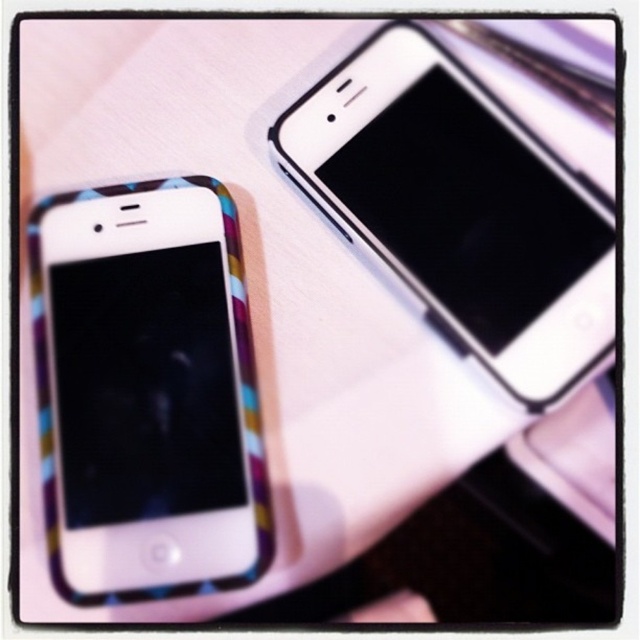
Question: Does matte plastic phone at left appear on the left side of white glossy smartphone at upper right?

Choices:
 (A) yes
 (B) no

Answer: (A)

Question: Which object appears closest to the camera in this image?

Choices:
 (A) white glossy smartphone at upper right
 (B) matte plastic phone at left

Answer: (B)

Question: Is matte plastic phone at left to the right of white glossy smartphone at upper right from the viewer's perspective?

Choices:
 (A) no
 (B) yes

Answer: (A)

Question: Is matte plastic phone at left thinner than white glossy smartphone at upper right?

Choices:
 (A) yes
 (B) no

Answer: (A)